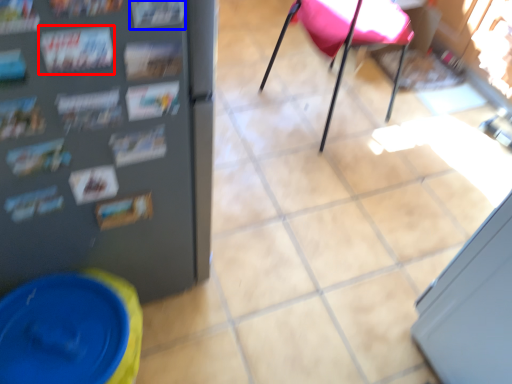
Question: Among these objects, which one is farthest to the camera, magazine (highlighted by a red box) or magazine (highlighted by a blue box)?

Choices:
 (A) magazine
 (B) magazine

Answer: (A)